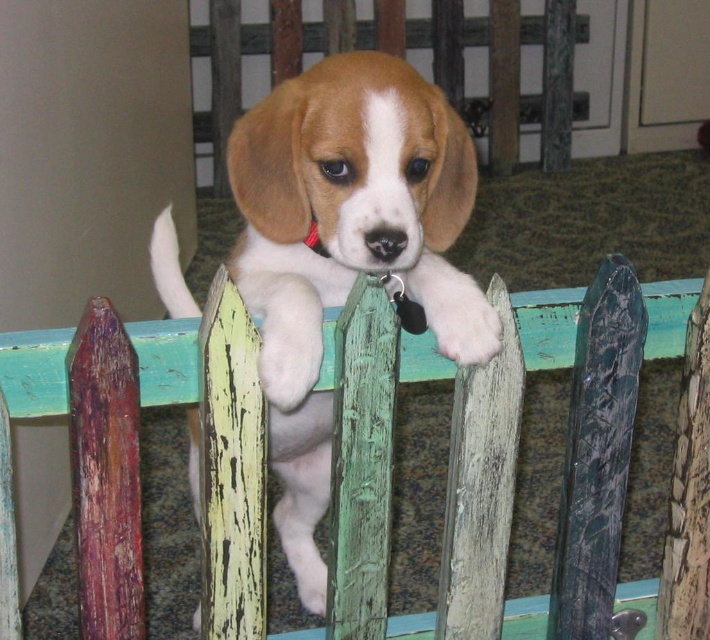
Question: Which of the following is the closest to the observer?

Choices:
 (A) (213, 620)
 (B) (364, 202)

Answer: (B)

Question: Which of the following is the closest to the observer?

Choices:
 (A) (650, 349)
 (B) (466, 289)

Answer: (B)

Question: Considering the relative positions of wooden picket fence at center and light brown fur at center in the image provided, where is wooden picket fence at center located with respect to light brown fur at center?

Choices:
 (A) below
 (B) above

Answer: (A)

Question: Is wooden picket fence at center positioned at the back of light brown fur at center?

Choices:
 (A) no
 (B) yes

Answer: (A)

Question: Which of the following is the closest to the observer?

Choices:
 (A) (339, 253)
 (B) (682, 324)

Answer: (A)

Question: Is the position of wooden picket fence at center less distant than that of light brown fur at center?

Choices:
 (A) no
 (B) yes

Answer: (B)